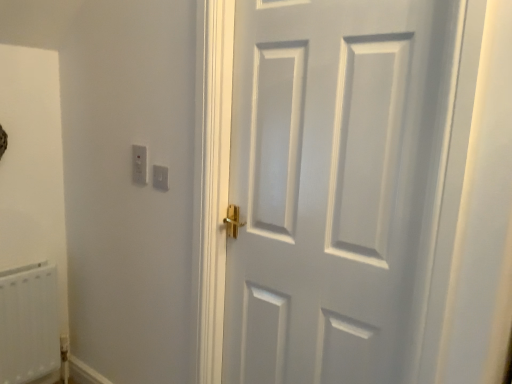
Describe the element at coordinates (335, 186) in the screenshot. I see `white matte door at center` at that location.

What is the approximate width of white plastic light switch at upper left?

white plastic light switch at upper left is 2.76 centimeters in width.

I want to click on white matte door at center, so click(335, 186).

Identify the location of light switch located behind the white matte door at center. (160, 177).

Based on their positions, is white plastic light switch at upper left located to the left or right of white matte door at center?

From the image, it's evident that white plastic light switch at upper left is to the left of white matte door at center.

From a real-world perspective, is white plastic light switch at upper left above or below white matte door at center?

From a real-world perspective, white plastic light switch at upper left is physically above white matte door at center.

Is white plastic light switch at upper left facing towards white matte door at center?

No, white plastic light switch at upper left is not oriented towards white matte door at center.

Could you tell me if white plastic radiator at lower left is facing white plastic light switch at upper left?

No, white plastic radiator at lower left does not turn towards white plastic light switch at upper left.

From the image's perspective, which object appears higher, white plastic radiator at lower left or white plastic light switch at upper left?

white plastic light switch at upper left is shown above in the image.

Choose the correct answer: Is white plastic radiator at lower left inside white plastic light switch at upper left or outside it?

white plastic radiator at lower left is not enclosed by white plastic light switch at upper left.

Is white plastic light switch at upper left looking in the opposite direction of white plastic radiator at lower left?

white plastic light switch at upper left is not turned away from white plastic radiator at lower left.

Is white plastic light switch at upper left to the left or to the right of white plastic radiator at lower left in the image?

Based on their positions, white plastic light switch at upper left is located to the right of white plastic radiator at lower left.

Considering the sizes of objects white plastic light switch at upper left and white plastic radiator at lower left in the image provided, who is wider, white plastic light switch at upper left or white plastic radiator at lower left?

Wider between the two is white plastic radiator at lower left.

Based on the photo, are white plastic light switch at upper left and white plastic radiator at lower left beside each other?

white plastic light switch at upper left is not next to white plastic radiator at lower left, and they're not touching.

From a real-world perspective, is white matte door at center positioned under white plastic light switch at upper left based on gravity?

Yes, from a real-world perspective, white matte door at center is beneath white plastic light switch at upper left.

Can you tell me how much white matte door at center and white plastic light switch at upper left differ in facing direction?

The angular difference between white matte door at center and white plastic light switch at upper left is 0.792 degrees.

Does white matte door at center turn towards white plastic light switch at upper left?

No.

Considering the sizes of objects white plastic radiator at lower left and white matte door at center in the image provided, who is smaller, white plastic radiator at lower left or white matte door at center?

With smaller size is white plastic radiator at lower left.

From the picture: From the image's perspective, is white plastic radiator at lower left positioned above or below white matte door at center?

white plastic radiator at lower left is situated lower than white matte door at center in the image.

Is white plastic radiator at lower left far away from white matte door at center?

Absolutely, white plastic radiator at lower left is distant from white matte door at center.

Where is `door located above the white plastic radiator at lower left (from the image's perspective)`? The image size is (512, 384). door located above the white plastic radiator at lower left (from the image's perspective) is located at coordinates (335, 186).

Is white matte door at center touching white plastic radiator at lower left?

There is a gap between white matte door at center and white plastic radiator at lower left.

Considering the positions of objects white matte door at center and white plastic radiator at lower left in the image provided, who is more to the right, white matte door at center or white plastic radiator at lower left?

From the viewer's perspective, white matte door at center appears more on the right side.

How different are the orientations of white matte door at center and white plastic radiator at lower left in degrees?

The angular difference between white matte door at center and white plastic radiator at lower left is 88.5 degrees.

Is white matte door at center positioned with its back to white plastic radiator at lower left?

No, white matte door at center is not facing away from white plastic radiator at lower left.

Locate an element on the screen. Image resolution: width=512 pixels, height=384 pixels. light switch on the left of the white matte door at center is located at coordinates (160, 177).

What are the coordinates of `light switch to the right of white plastic radiator at lower left` in the screenshot? It's located at (160, 177).

Considering their positions, is white plastic light switch at upper left positioned closer to white plastic radiator at lower left than white matte door at center?

Among the two, white plastic light switch at upper left is located nearer to white plastic radiator at lower left.

Which object lies further to the anchor point white plastic light switch at upper left, white matte door at center or white plastic radiator at lower left?

Among the two, white plastic radiator at lower left is located further to white plastic light switch at upper left.

Considering their positions, is white matte door at center positioned closer to white plastic radiator at lower left than white plastic light switch at upper left?

The object closer to white plastic radiator at lower left is white plastic light switch at upper left.

Based on their spatial positions, is white plastic radiator at lower left or white matte door at center further from white plastic light switch at upper left?

Based on the image, white plastic radiator at lower left appears to be further to white plastic light switch at upper left.

Estimate the real-world distances between objects in this image. Which object is further from white matte door at center, white plastic radiator at lower left or white plastic light switch at upper left?

Based on the image, white plastic radiator at lower left appears to be further to white matte door at center.

In the scene shown: Looking at the image, which one is located closer to white matte door at center, white plastic light switch at upper left or white plastic radiator at lower left?

Among the two, white plastic light switch at upper left is located nearer to white matte door at center.

The height and width of the screenshot is (384, 512). Identify the location of light switch between white plastic radiator at lower left and white matte door at center in the horizontal direction. (160, 177).